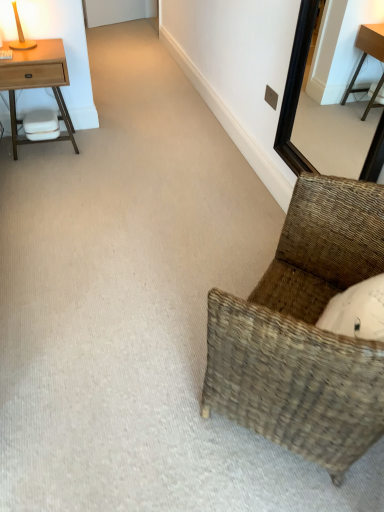
Question: From a real-world perspective, is matte wooden table lamp at upper left below light wood nightstand at left?

Choices:
 (A) yes
 (B) no

Answer: (B)

Question: Could you tell me if matte wooden table lamp at upper left is facing light wood nightstand at left?

Choices:
 (A) yes
 (B) no

Answer: (B)

Question: Considering the relative sizes of matte wooden table lamp at upper left and light wood nightstand at left in the image provided, is matte wooden table lamp at upper left smaller than light wood nightstand at left?

Choices:
 (A) yes
 (B) no

Answer: (A)

Question: Is matte wooden table lamp at upper left taller than light wood nightstand at left?

Choices:
 (A) no
 (B) yes

Answer: (A)

Question: Is matte wooden table lamp at upper left bigger than light wood nightstand at left?

Choices:
 (A) yes
 (B) no

Answer: (B)

Question: Is matte wooden table lamp at upper left at the left side of light wood nightstand at left?

Choices:
 (A) yes
 (B) no

Answer: (A)

Question: From the image's perspective, is matte wooden table lamp at upper left located above black wooden mirror at upper right?

Choices:
 (A) yes
 (B) no

Answer: (A)

Question: Does matte wooden table lamp at upper left have a greater width compared to black wooden mirror at upper right?

Choices:
 (A) yes
 (B) no

Answer: (A)

Question: Is matte wooden table lamp at upper left far away from black wooden mirror at upper right?

Choices:
 (A) no
 (B) yes

Answer: (B)

Question: From a real-world perspective, is matte wooden table lamp at upper left positioned over black wooden mirror at upper right based on gravity?

Choices:
 (A) no
 (B) yes

Answer: (B)

Question: Is matte wooden table lamp at upper left oriented away from black wooden mirror at upper right?

Choices:
 (A) no
 (B) yes

Answer: (A)

Question: Can you confirm if matte wooden table lamp at upper left is smaller than black wooden mirror at upper right?

Choices:
 (A) yes
 (B) no

Answer: (A)

Question: Is the position of woven brown chair at lower right more distant than that of black wooden mirror at upper right?

Choices:
 (A) yes
 (B) no

Answer: (B)